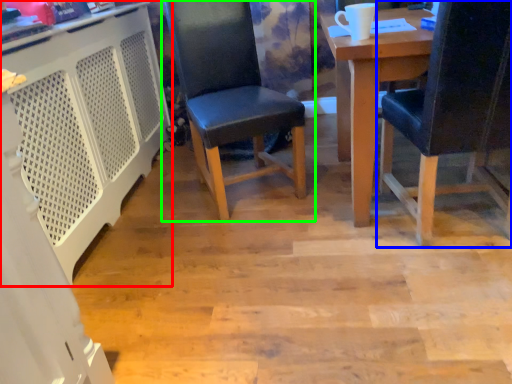
Question: Which is nearer to the computer desk (highlighted by a red box)? chair (highlighted by a blue box) or chair (highlighted by a green box).

Choices:
 (A) chair
 (B) chair

Answer: (B)